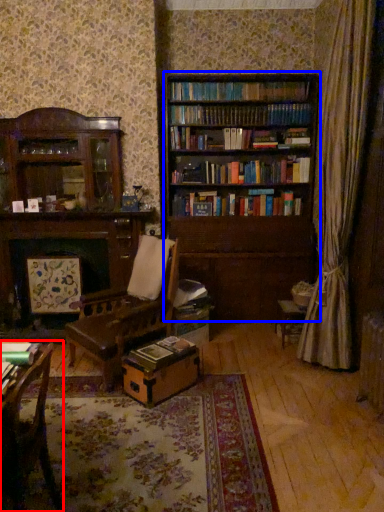
Question: Which object is further to the camera taking this photo, chair (highlighted by a red box) or bookcase (highlighted by a blue box)?

Choices:
 (A) chair
 (B) bookcase

Answer: (B)